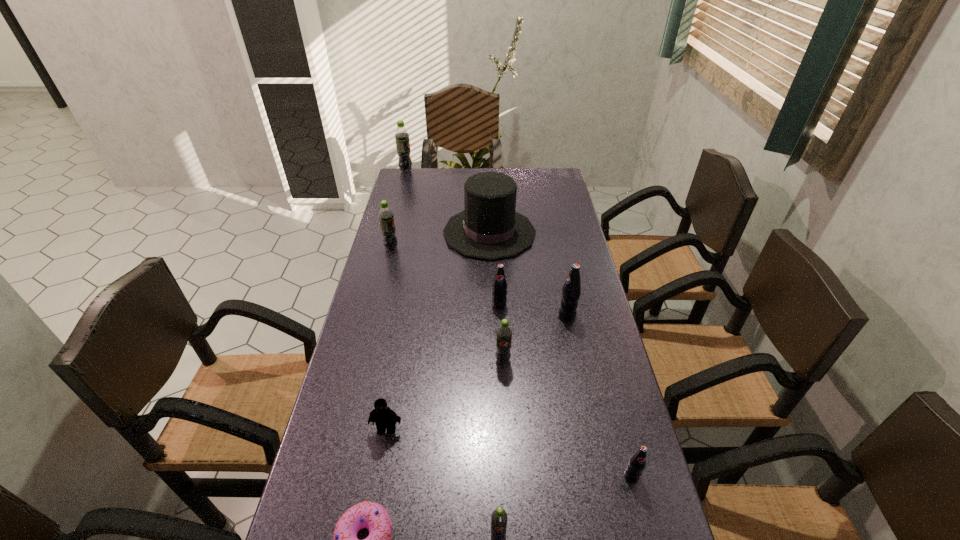
Where is `free location located 0.050m on the front label of the biggest black pop`? The image size is (960, 540). free location located 0.050m on the front label of the biggest black pop is located at coordinates (541, 316).

In order to click on free space located 0.110m on the front label of the biggest black pop in this screenshot , I will do `click(521, 316)`.

You are a GUI agent. You are given a task and a screenshot of the screen. Output one action in this format:
    pyautogui.click(x=<x>, y=<y>)
    Task: Click on the vacant position located 0.270m on the front label of the leftmost black pop
    This screenshot has height=540, width=960.
    Given the screenshot: What is the action you would take?
    pyautogui.click(x=503, y=384)

The image size is (960, 540). I want to click on vacant space positioned on the front label of the third biggest green soda, so click(509, 474).

Find the location of `vacant space situated on the face of the black Lego`. vacant space situated on the face of the black Lego is located at coordinates (376, 487).

The image size is (960, 540). Find the location of `object situated at the far edge`. object situated at the far edge is located at coordinates tap(401, 135).

The image size is (960, 540). Find the location of `Lego positioned at the left edge`. Lego positioned at the left edge is located at coordinates (385, 418).

Locate an element on the screen. This screenshot has width=960, height=540. dress hat present at the right edge is located at coordinates pos(489,228).

Locate an element on the screen. The height and width of the screenshot is (540, 960). object situated at the far left corner is located at coordinates (401, 135).

You are a GUI agent. You are given a task and a screenshot of the screen. Output one action in this format:
    pyautogui.click(x=<x>, y=<y>)
    Task: Click on the free region at the far edge
    The height and width of the screenshot is (540, 960).
    Given the screenshot: What is the action you would take?
    pyautogui.click(x=504, y=171)